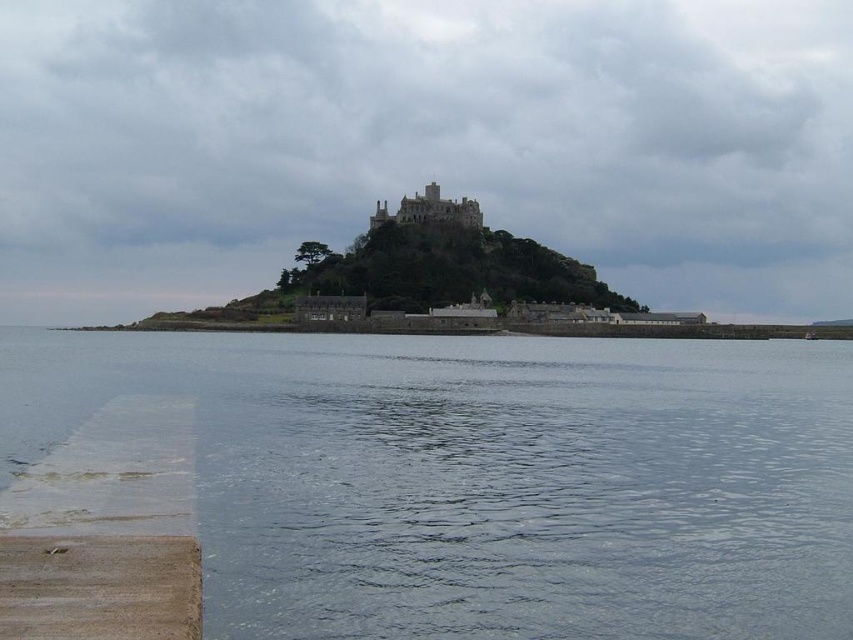
Question: Which of these objects is positioned farthest from the brown wooden dock at lower left?

Choices:
 (A) stone medieval castle at center
 (B) clear water at lower left

Answer: (A)

Question: Which point appears farthest from the camera in this image?

Choices:
 (A) (224, 429)
 (B) (380, 224)
 (C) (109, 500)

Answer: (B)

Question: Does brown wooden dock at lower left have a lesser width compared to stone medieval castle at center?

Choices:
 (A) no
 (B) yes

Answer: (B)

Question: Which of the following is the closest to the observer?

Choices:
 (A) (459, 208)
 (B) (65, 513)

Answer: (B)

Question: Does brown wooden dock at lower left have a smaller size compared to stone medieval castle at center?

Choices:
 (A) no
 (B) yes

Answer: (B)

Question: Does brown wooden dock at lower left come behind stone medieval castle at center?

Choices:
 (A) yes
 (B) no

Answer: (B)